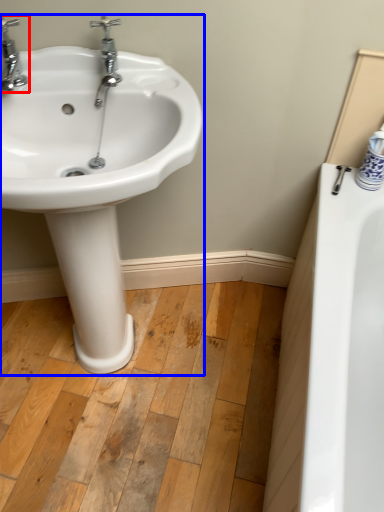
Question: Among these objects, which one is farthest to the camera, tap (highlighted by a red box) or sink (highlighted by a blue box)?

Choices:
 (A) tap
 (B) sink

Answer: (A)